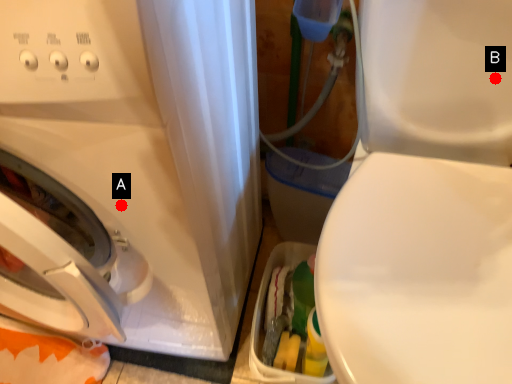
Question: Two points are circled on the image, labeled by A and B beside each circle. Which point is closer to the camera taking this photo?

Choices:
 (A) A is closer
 (B) B is closer

Answer: (A)